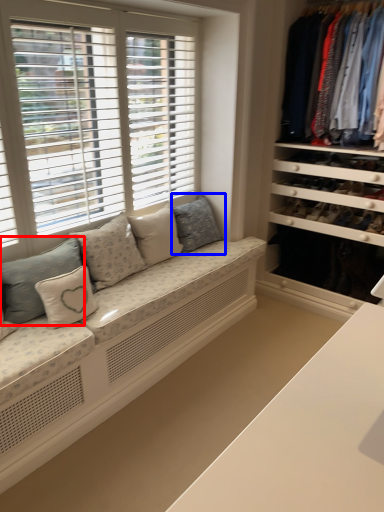
Question: Which object appears farthest to the camera in this image, pillow (highlighted by a red box) or pillow (highlighted by a blue box)?

Choices:
 (A) pillow
 (B) pillow

Answer: (B)